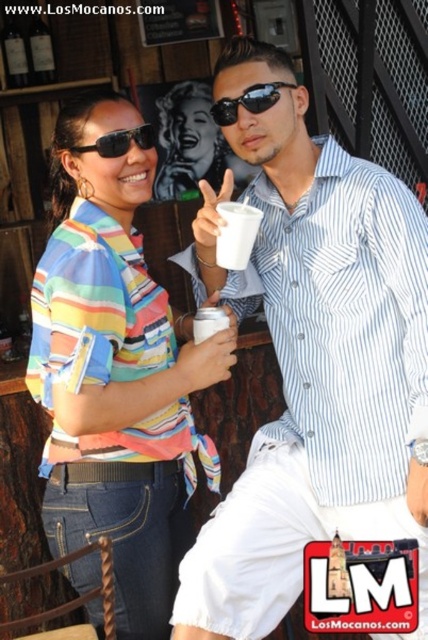
You are standing at the position of the person on the right holding the white matte cup at center. You want to hand the cup to the person on the left. Can you reach them without moving your feet?

The distance between the two people is 5.33 feet. Since the average human arm span is about 5 feet, you would need to stretch your arms to reach the person on the left, but it might be possible if you extend your arms fully.

You are a photographer at the event and want to take a photo of the two people. However, you notice an object in the foreground might block part of the scene. Which object, the white matte cup at center or the black matte sunglasses at upper left, is closer to the camera and could potentially obstruct the background?

The white matte cup at center is in front of the black matte sunglasses at upper left, so it is closer to the camera and could potentially obstruct the background.